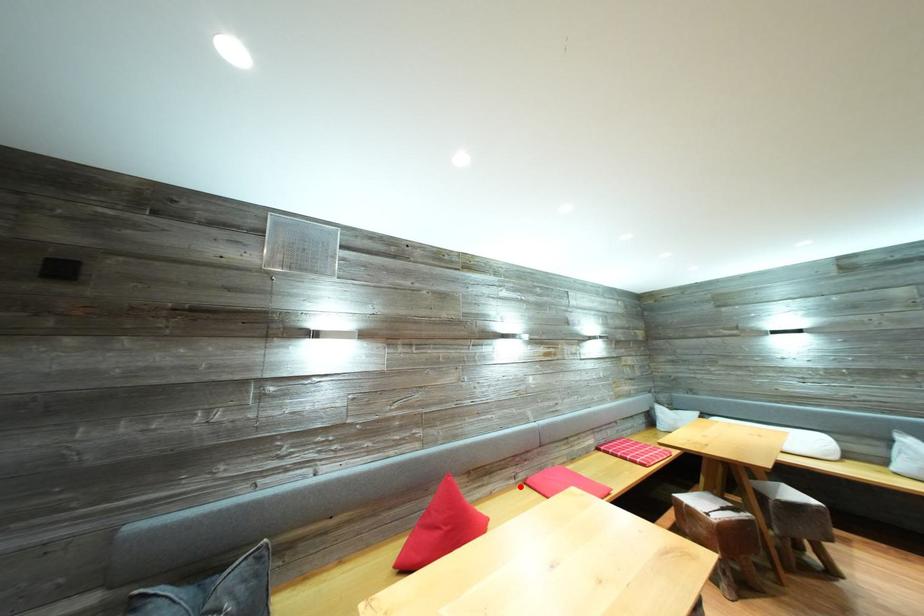
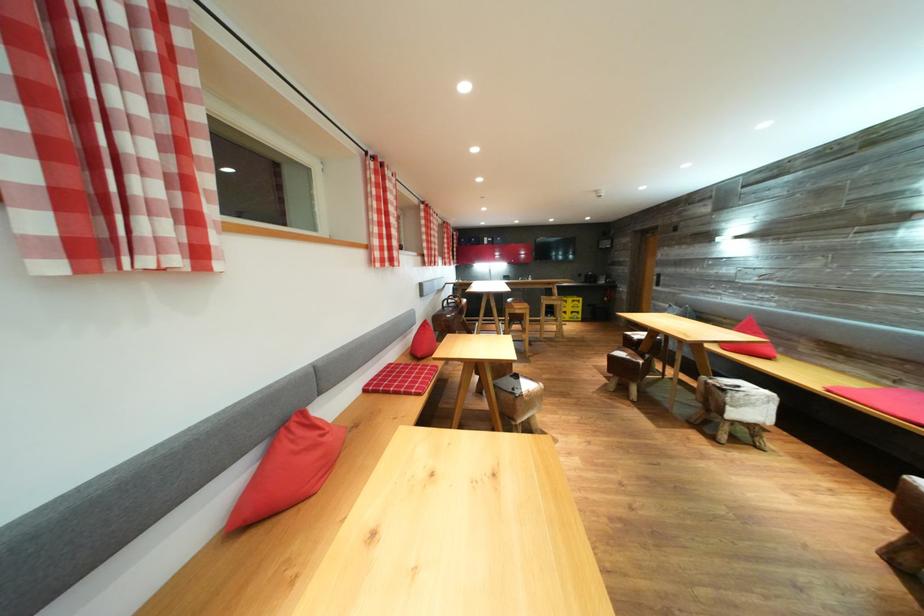
Find the pixel in the second image that matches the highlighted location in the first image.

(895, 389)